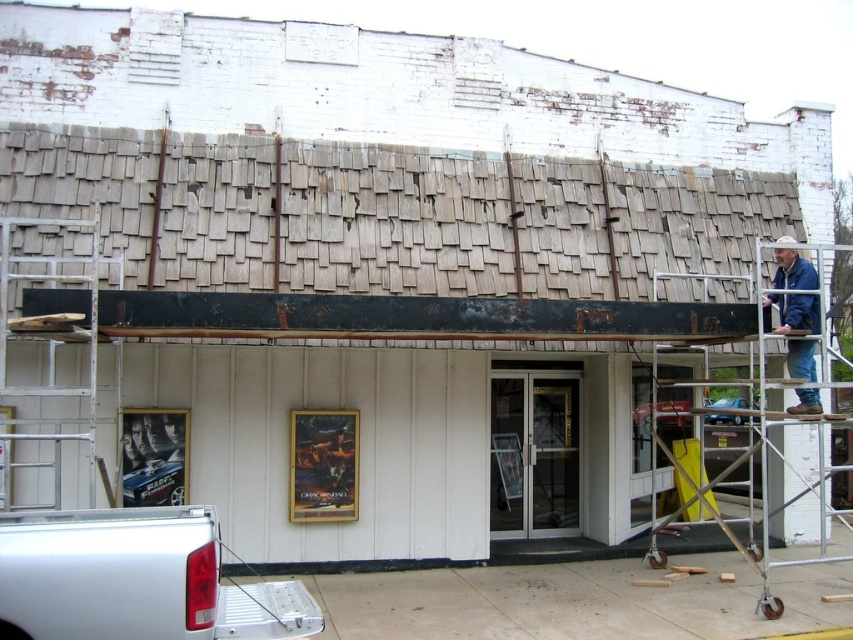
Question: Which of these objects is positioned farthest from the metal scaffolding at right?

Choices:
 (A) white metallic truck at lower left
 (B) silver metallic ladder at left

Answer: (B)

Question: Is the position of white metallic truck at lower left more distant than that of blue denim jacket at upper right?

Choices:
 (A) no
 (B) yes

Answer: (A)

Question: Is white metallic truck at lower left above silver metallic ladder at left?

Choices:
 (A) yes
 (B) no

Answer: (B)

Question: Where is blue denim jacket at upper right located in relation to metal scaffolding at right in the image?

Choices:
 (A) left
 (B) right

Answer: (A)

Question: Based on their relative distances, which object is farther from the silver metallic ladder at left?

Choices:
 (A) blue denim jacket at upper right
 (B) metal scaffolding at right

Answer: (B)

Question: Which object appears farthest from the camera in this image?

Choices:
 (A) blue denim jacket at upper right
 (B) metal scaffolding at right
 (C) white metallic truck at lower left

Answer: (B)